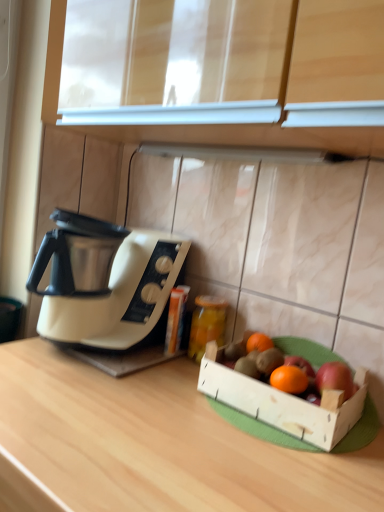
I want to click on vacant space in front of translucent glass jar at center, so click(178, 393).